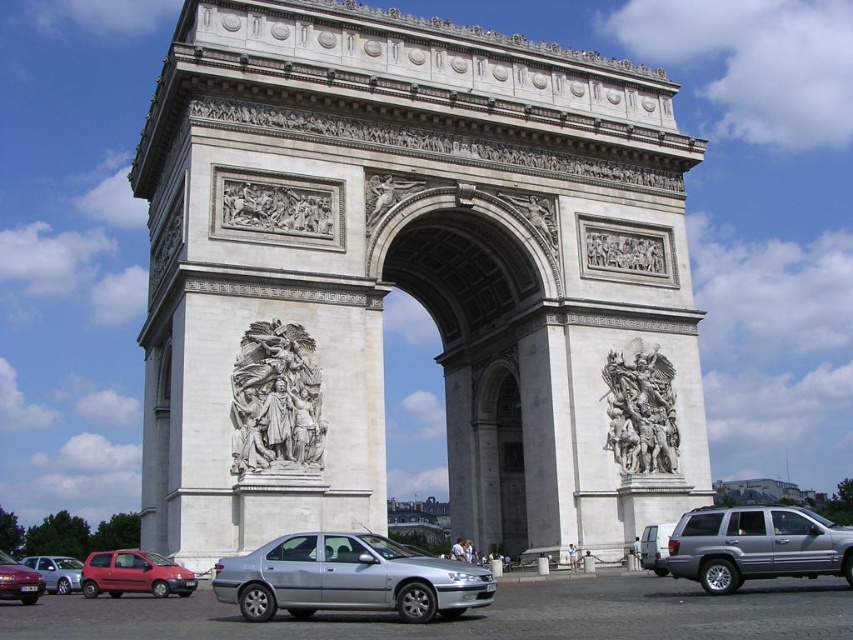
You are a tourist standing at the entrance of the Arc de Triomphe. You see a polished bronze sculpture at center and a silver metallic sedan at lower left. Which object is positioned further to the right from your viewpoint?

The polished bronze sculpture at center is positioned further to the right from your viewpoint compared to the silver metallic sedan at lower left.

You are standing at the base of the Arc de Triomphe and notice a silver metallic sedan at center. If you were to walk directly towards the point marked at coordinates (347, 579), would you be moving towards the sedan?

Yes, walking towards the point (347, 579) would lead you directly to the silver metallic sedan at center since that point corresponds to its location.